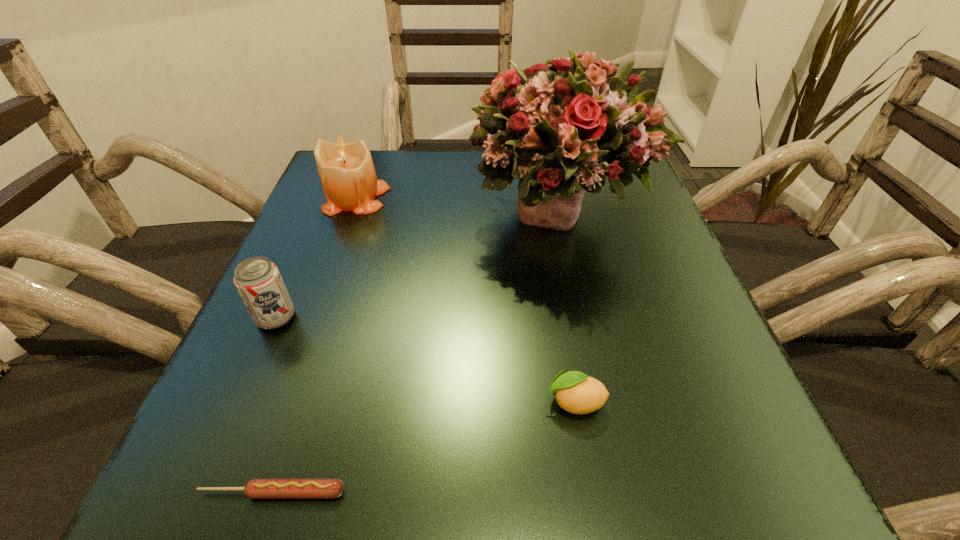
The image size is (960, 540). I want to click on empty space between the fourth farthest object and the bouquet, so click(566, 307).

The height and width of the screenshot is (540, 960). Find the location of `object identified as the third closest to the beer can`. object identified as the third closest to the beer can is located at coordinates (563, 127).

Locate which object is the closest to the bouquet. Please provide its 2D coordinates. Your answer should be formatted as a tuple, i.e. [(x, y)], where the tuple contains the x and y coordinates of a point satisfying the conditions above.

[(347, 175)]

The width and height of the screenshot is (960, 540). Find the location of `vacant position in the image that satisfies the following two spatial constraints: 1. on the front side of the fourth shortest object; 2. on the right side of the sausage`. vacant position in the image that satisfies the following two spatial constraints: 1. on the front side of the fourth shortest object; 2. on the right side of the sausage is located at coordinates (252, 492).

I want to click on vacant space that satisfies the following two spatial constraints: 1. on the front side of the third farthest object; 2. on the left side of the shortest object, so click(200, 492).

The image size is (960, 540). I want to click on vacant space that satisfies the following two spatial constraints: 1. on the front side of the bouquet; 2. on the right side of the candle, so click(351, 213).

Image resolution: width=960 pixels, height=540 pixels. I want to click on vacant space that satisfies the following two spatial constraints: 1. with leaves positioned above the second nearest object; 2. on the front side of the shortest object, so click(589, 492).

This screenshot has width=960, height=540. Find the location of `free space that satisfies the following two spatial constraints: 1. on the back side of the fourth shortest object; 2. on the left side of the third farthest object`. free space that satisfies the following two spatial constraints: 1. on the back side of the fourth shortest object; 2. on the left side of the third farthest object is located at coordinates (328, 198).

I want to click on vacant area that satisfies the following two spatial constraints: 1. on the front side of the beer can; 2. on the right side of the shortest object, so click(x=200, y=492).